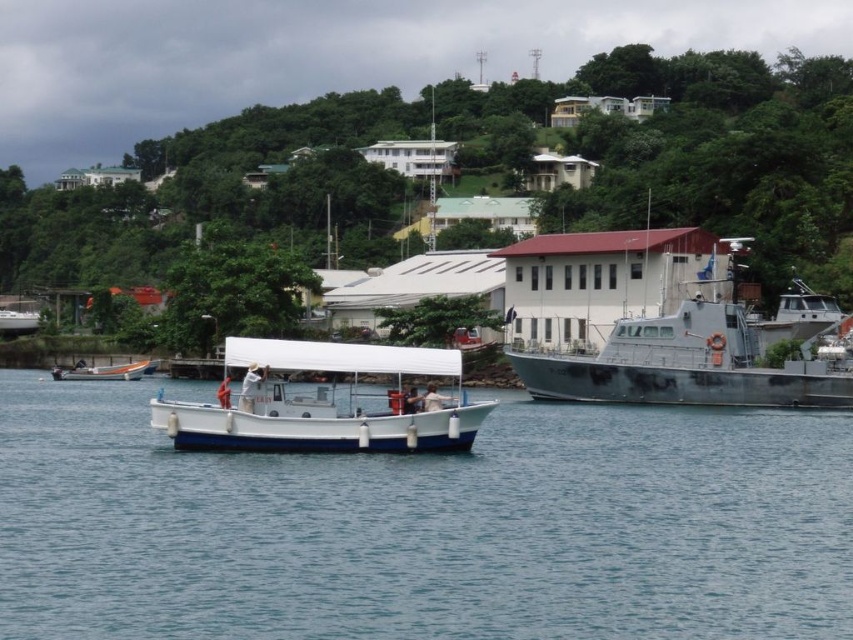
You are a photographer planning to capture both the white matte boat at center and the white plastic boat at center in a single shot. Given their sizes, which boat should you position closer to the camera to ensure both appear roughly the same size in the photo?

To make both boats appear roughly the same size in the photo, you should position the smaller white plastic boat at center closer to the camera than the larger white matte boat at center since the white matte boat at center is larger in size than the white plastic boat at center.

You are a drone operator tasked with capturing aerial footage of the white matte boat at center. The drone must hover directly above the boat to get the best shot. Given that the drone can only move in straight lines from its current position at point A, which is at coordinates 0.5, 0.5, will it need to adjust its path to avoid the military ship?

The white matte boat at center is located at point (323, 403). Since the drone is at (426, 320), the straight line path would pass through the military ship, so the drone needs to adjust its path to avoid it.